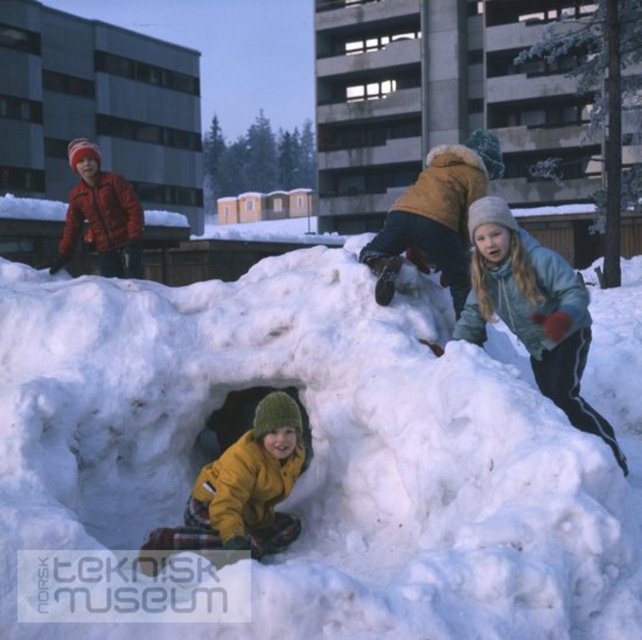
Question: Which of the following is the farthest from the observer?

Choices:
 (A) (266, 502)
 (B) (535, 252)
 (C) (498, 556)

Answer: (A)

Question: Is white fluffy snow at center above blue fleece jacket at upper right?

Choices:
 (A) no
 (B) yes

Answer: (A)

Question: From the image, what is the correct spatial relationship of white fluffy snow at center in relation to yellow fleece jacket at center?

Choices:
 (A) right
 (B) left

Answer: (A)

Question: Which object is closer to the camera taking this photo?

Choices:
 (A) white fluffy snow at center
 (B) yellow fleece jacket at center
 (C) blue fleece jacket at upper right

Answer: (B)

Question: Which of these objects is positioned closest to the blue fleece jacket at upper right?

Choices:
 (A) white fluffy snow at center
 (B) yellow fleece jacket at center

Answer: (A)

Question: Can you confirm if white fluffy snow at center is smaller than yellow fleece jacket at center?

Choices:
 (A) no
 (B) yes

Answer: (B)